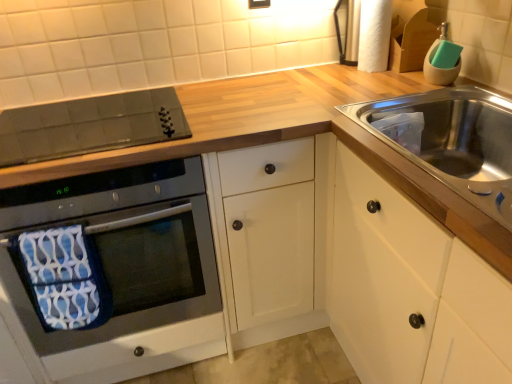
Question: Should I look upward or downward to see matte black electric outlet at upper center?

Choices:
 (A) up
 (B) down

Answer: (A)

Question: Considering the relative sizes of black glass oven at left and matte black electric outlet at upper center in the image provided, is black glass oven at left smaller than matte black electric outlet at upper center?

Choices:
 (A) yes
 (B) no

Answer: (B)

Question: Is black glass oven at left with matte black electric outlet at upper center?

Choices:
 (A) yes
 (B) no

Answer: (B)

Question: From a real-world perspective, is black glass oven at left positioned over matte black electric outlet at upper center based on gravity?

Choices:
 (A) no
 (B) yes

Answer: (A)

Question: Considering the relative sizes of black glass oven at left and matte black electric outlet at upper center in the image provided, is black glass oven at left shorter than matte black electric outlet at upper center?

Choices:
 (A) yes
 (B) no

Answer: (B)

Question: Considering the relative sizes of black glass oven at left and matte black electric outlet at upper center in the image provided, is black glass oven at left thinner than matte black electric outlet at upper center?

Choices:
 (A) no
 (B) yes

Answer: (A)

Question: Considering the relative sizes of black glass oven at left and matte black electric outlet at upper center in the image provided, is black glass oven at left wider than matte black electric outlet at upper center?

Choices:
 (A) yes
 (B) no

Answer: (A)

Question: Would you say matte black electric outlet at upper center is outside black glass oven at left?

Choices:
 (A) yes
 (B) no

Answer: (A)

Question: Is matte black electric outlet at upper center facing away from black glass oven at left?

Choices:
 (A) no
 (B) yes

Answer: (A)

Question: From the image's perspective, is matte black electric outlet at upper center on black glass oven at left?

Choices:
 (A) yes
 (B) no

Answer: (A)

Question: From a real-world perspective, is matte black electric outlet at upper center physically below black glass oven at left?

Choices:
 (A) no
 (B) yes

Answer: (A)

Question: Is black glass oven at left located within matte black electric outlet at upper center?

Choices:
 (A) yes
 (B) no

Answer: (B)

Question: Is matte black electric outlet at upper center far away from black glass oven at left?

Choices:
 (A) no
 (B) yes

Answer: (B)

Question: Does black glass cooktop at upper left have a smaller size compared to black glass oven at left?

Choices:
 (A) no
 (B) yes

Answer: (B)